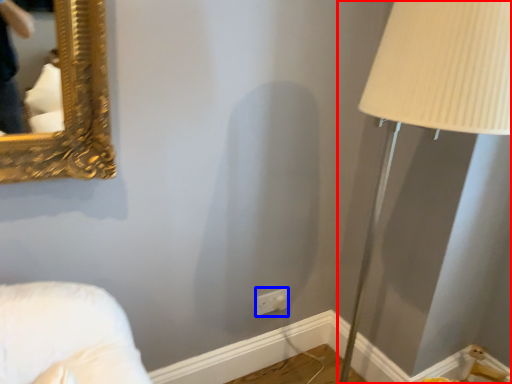
Question: Among these objects, which one is farthest to the camera, table lamp (highlighted by a red box) or electric outlet (highlighted by a blue box)?

Choices:
 (A) table lamp
 (B) electric outlet

Answer: (B)